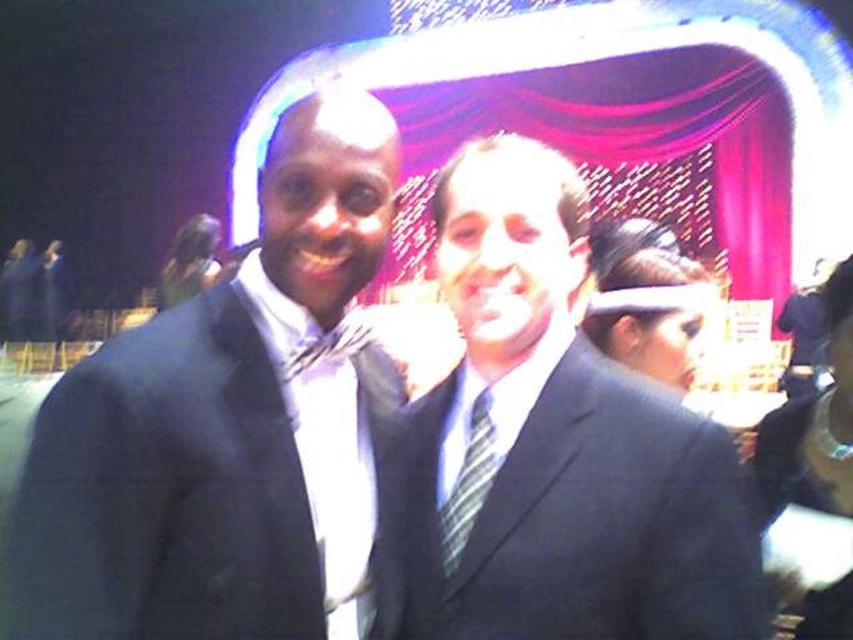
Question: Which of the following is the closest to the observer?

Choices:
 (A) striped fabric tie at center
 (B) matte black suit at center

Answer: (B)

Question: Considering the relative positions of matte black suit at center and striped fabric tie at center in the image provided, where is matte black suit at center located with respect to striped fabric tie at center?

Choices:
 (A) above
 (B) below

Answer: (A)

Question: Which object appears farthest from the camera in this image?

Choices:
 (A) matte black suit at center
 (B) matte black suit at left
 (C) striped fabric tie at center

Answer: (C)

Question: Which object is positioned farthest from the striped fabric tie at center?

Choices:
 (A) matte black suit at center
 (B) matte black suit at left

Answer: (B)

Question: Where is matte black suit at center located in relation to striped fabric tie at center in the image?

Choices:
 (A) above
 (B) below

Answer: (A)

Question: Is matte black suit at center positioned behind striped fabric tie at center?

Choices:
 (A) yes
 (B) no

Answer: (B)